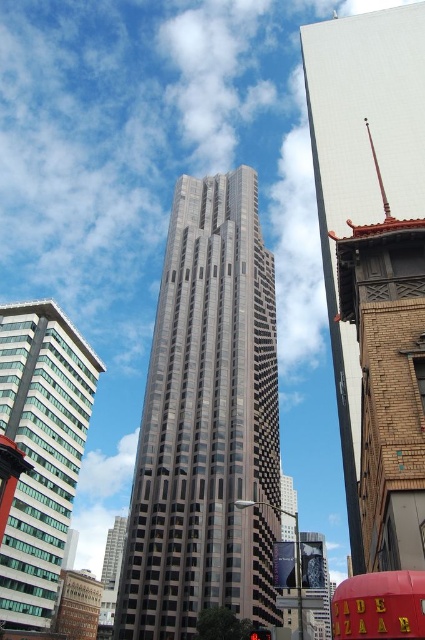
Question: Can you confirm if shiny glass skyscraper at center is smaller than green glass building at left?

Choices:
 (A) no
 (B) yes

Answer: (A)

Question: Can you confirm if shiny glass skyscraper at center is thinner than red inflatable sign at center?

Choices:
 (A) no
 (B) yes

Answer: (B)

Question: Estimate the real-world distances between objects in this image. Which object is farther from the red inflatable sign at center?

Choices:
 (A) shiny glass skyscraper at center
 (B) glassy steel skyscraper at center

Answer: (A)

Question: Estimate the real-world distances between objects in this image. Which object is farther from the glassy steel skyscraper at center?

Choices:
 (A) red inflatable sign at center
 (B) green glass building at left
 (C) shiny glass skyscraper at center

Answer: (A)

Question: In this image, where is shiny glass skyscraper at center located relative to glassy steel skyscraper at center?

Choices:
 (A) left
 (B) right

Answer: (A)

Question: Which point is farther to the camera?

Choices:
 (A) (363, 632)
 (B) (119, 614)
 (C) (351, 522)

Answer: (B)